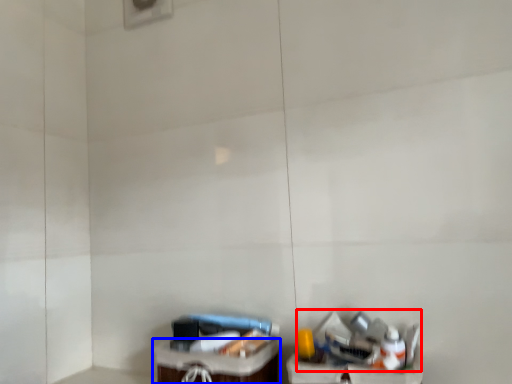
Question: Which of the following is the closest to the observer, garbage (highlighted by a red box) or furniture (highlighted by a blue box)?

Choices:
 (A) garbage
 (B) furniture

Answer: (A)